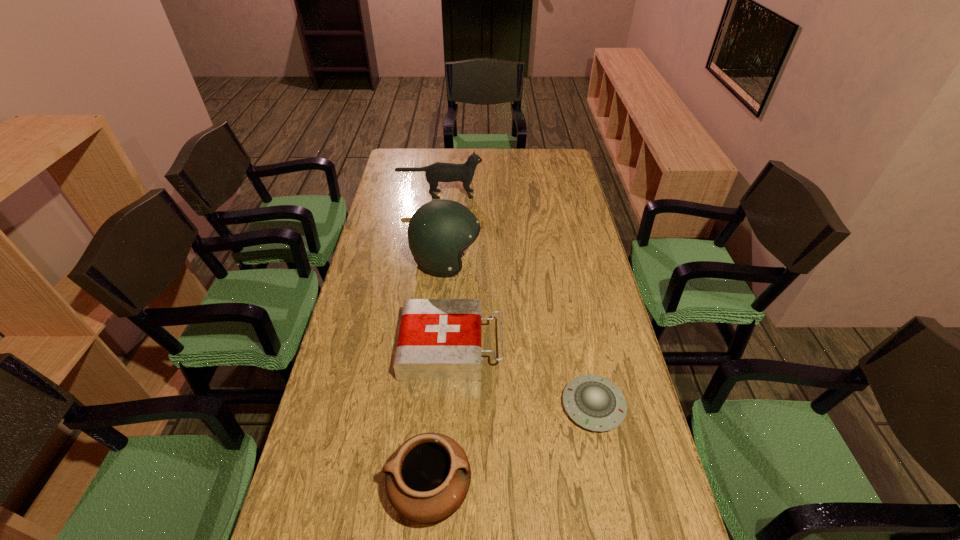
Find the location of a particular element. vacant region located on the front-facing side of the cat is located at coordinates (493, 194).

In order to click on vacant space located 0.250m on the back of the nearest object in this screenshot , I will do `click(441, 366)`.

Identify the location of blank space located on the front side of the fourth tallest object. The image size is (960, 540). (583, 347).

Identify the location of vacant space situated on the front of the rightmost object. (615, 511).

The image size is (960, 540). In order to click on object that is at the left edge in this screenshot , I will do `click(438, 172)`.

Find the location of a particular element. The height and width of the screenshot is (540, 960). object located in the right edge section of the desktop is located at coordinates (595, 403).

Find the location of a particular element. The width and height of the screenshot is (960, 540). free space at the far edge is located at coordinates (426, 166).

Locate an element on the screen. The height and width of the screenshot is (540, 960). vacant space at the left edge is located at coordinates (379, 299).

The width and height of the screenshot is (960, 540). In the image, there is a desktop. Identify the location of vacant space at the right edge. 578,195.

Where is `free region at the far left corner of the desktop`? This screenshot has width=960, height=540. free region at the far left corner of the desktop is located at coordinates (423, 151).